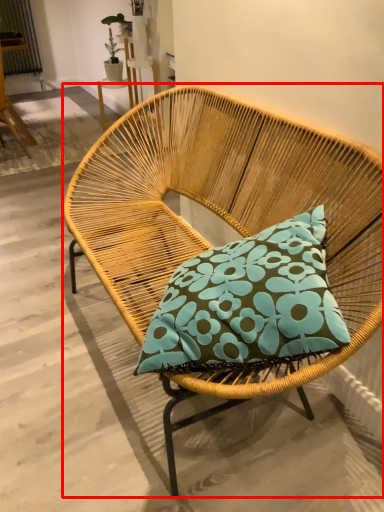
Question: From the image's perspective, what is the correct spatial positioning of chair (annotated by the red box) in reference to chair?

Choices:
 (A) below
 (B) above

Answer: (A)